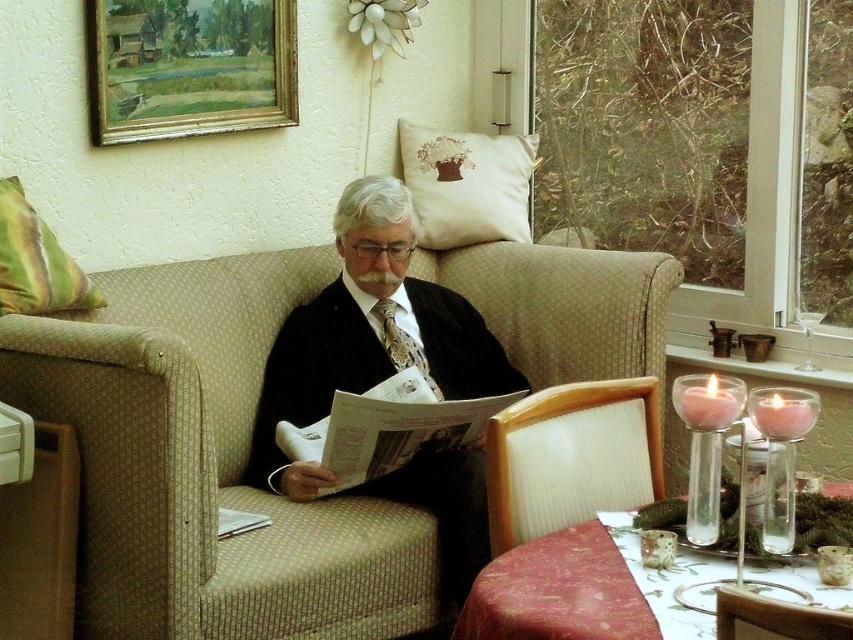
You are a furniture designer analyzing the seating arrangement in the image. Which object, the beige fabric couch at center or the white embroidered cushion at upper center, has a greater height?

The beige fabric couch at center is taller than the white embroidered cushion at upper center.

You are arranging flowers and need to place a vase between the white embroidered cushion at upper center and the wooden chair at lower right. Which side of the cushion should the vase be placed to ensure it is closer to the chair?

The vase should be placed to the right side of the white embroidered cushion at upper center since the cushion is to the left of the wooden chair at lower right, making the right side closer to the chair.

You are designing a layout for a magazine article about fashion and need to place the matte black suit at center and the green striped pillow at left in the same photo. Based on the scene described, which object should be placed first to ensure proper spacing? Explain your reasoning.

The matte black suit at center should be placed first because its width surpasses the green striped pillow at left, so positioning it first ensures there is enough space allocated for its larger size.